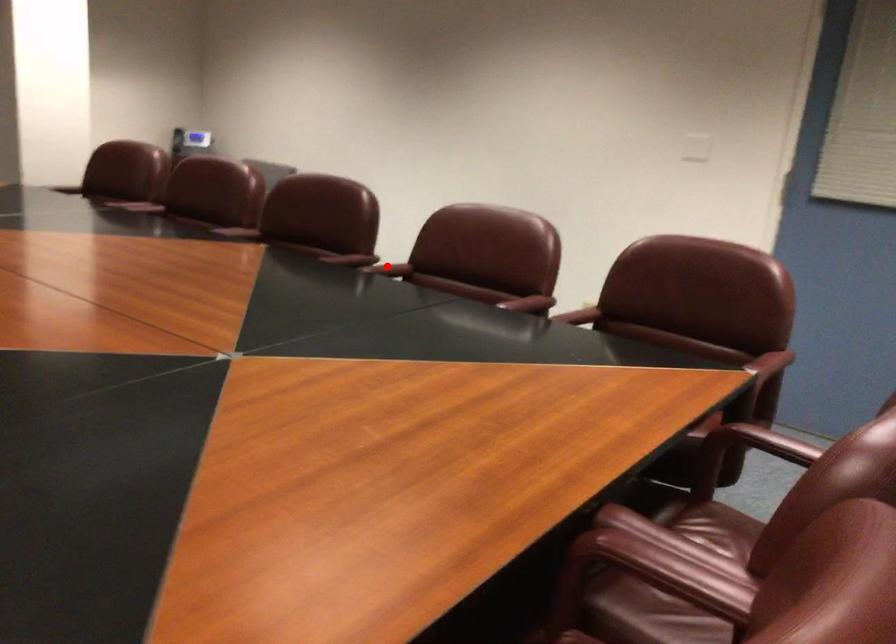
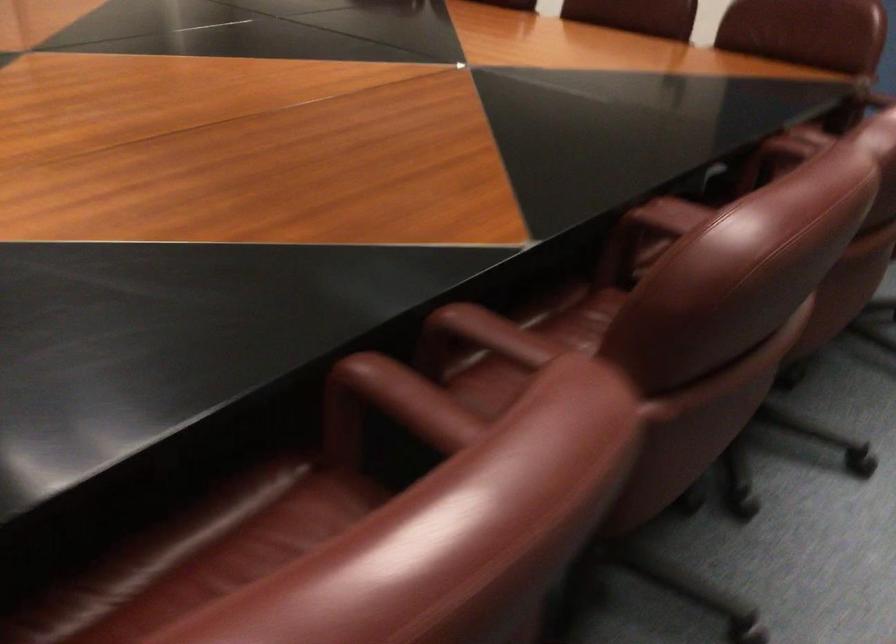
Find the pixel in the second image that matches the highlighted location in the first image.

(392, 404)